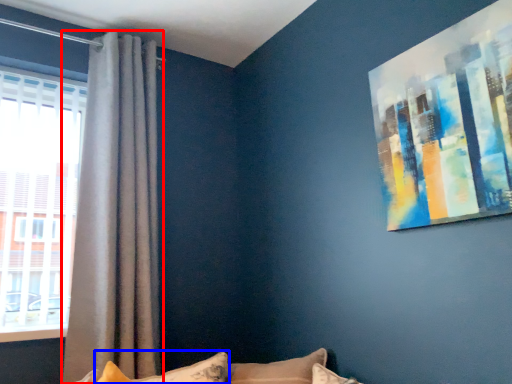
Question: Among these objects, which one is farthest to the camera, curtain (highlighted by a red box) or pillow (highlighted by a blue box)?

Choices:
 (A) curtain
 (B) pillow

Answer: (A)